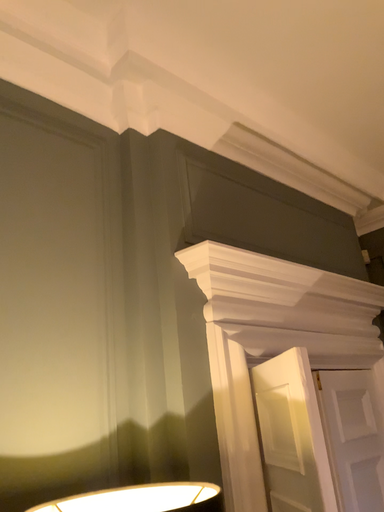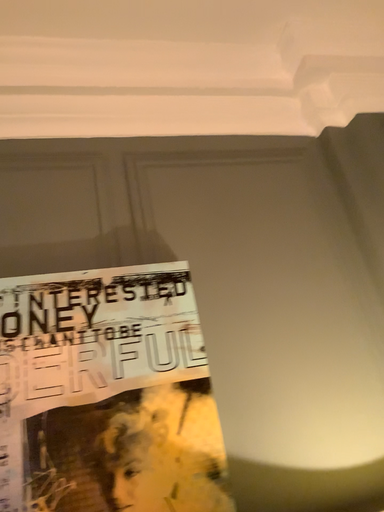
Question: How did the camera likely rotate when shooting the video?

Choices:
 (A) rotated left
 (B) rotated right

Answer: (A)